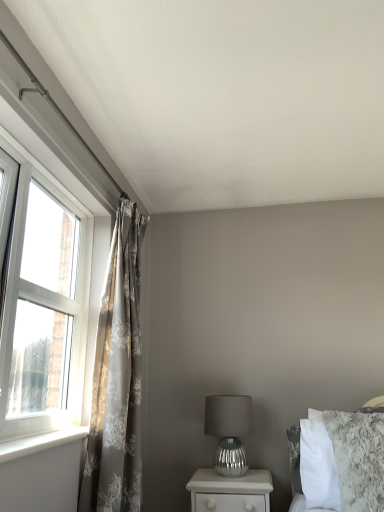
The width and height of the screenshot is (384, 512). In order to click on white plastic window at left in this screenshot , I will do `click(48, 305)`.

At what (x,y) coordinates should I click in order to perform the action: click on silky gray curtains at left. Please return your answer as a coordinate pair (x, y). The width and height of the screenshot is (384, 512). Looking at the image, I should click on point(117,377).

What do you see at coordinates (117, 377) in the screenshot?
I see `silky gray curtains at left` at bounding box center [117, 377].

Where is `white plastic window at left`? The height and width of the screenshot is (512, 384). white plastic window at left is located at coordinates (48, 305).

Is silky gray curtains at left to the left of silver metallic table lamp at center from the viewer's perspective?

Yes.

Consider the image. From a real-world perspective, which is physically above, silky gray curtains at left or silver metallic table lamp at center?

silky gray curtains at left.

Is silky gray curtains at left wider than silver metallic table lamp at center?

No, silky gray curtains at left is not wider than silver metallic table lamp at center.

Does silky gray curtains at left lie in front of silver metallic table lamp at center?

That is True.

Is white plastic window at left oriented away from white plastic window sill at left?

No, white plastic window sill at left is not at the back of white plastic window at left.

Considering the relative sizes of white plastic window at left and white plastic window sill at left in the image provided, is white plastic window at left thinner than white plastic window sill at left?

No.

Considering the relative sizes of white plastic window at left and white plastic window sill at left in the image provided, is white plastic window at left shorter than white plastic window sill at left?

Incorrect, the height of white plastic window at left does not fall short of that of white plastic window sill at left.

Where is `curtain below the white plastic window at left (from the image's perspective)`? This screenshot has width=384, height=512. curtain below the white plastic window at left (from the image's perspective) is located at coordinates (117, 377).

Is white plastic window at left wider or thinner than silky gray curtains at left?

Considering their sizes, white plastic window at left looks slimmer than silky gray curtains at left.

Which point is more distant from viewer, (69, 313) or (122, 466)?

The point (69, 313) is behind.

In the scene shown: Is white plastic window at left looking in the opposite direction of silky gray curtains at left?

No, white plastic window at left is not facing away from silky gray curtains at left.

From the image's perspective, which is below, silky gray curtains at left or white fluffy bed at upper right?

white fluffy bed at upper right is shown below in the image.

From their relative heights in the image, would you say silky gray curtains at left is taller or shorter than white fluffy bed at upper right?

Considering their sizes, silky gray curtains at left has more height than white fluffy bed at upper right.

Are silky gray curtains at left and white fluffy bed at upper right making contact?

silky gray curtains at left and white fluffy bed at upper right are clearly separated.

Is white fluffy bed at upper right a part of silky gray curtains at left?

No, white fluffy bed at upper right is not inside silky gray curtains at left.

How much distance is there between white plastic window sill at left and white fluffy bed at upper right?

A distance of 1.11 meters exists between white plastic window sill at left and white fluffy bed at upper right.

Is white plastic window sill at left turned away from white fluffy bed at upper right?

No, white plastic window sill at left's orientation is not away from white fluffy bed at upper right.

Would you say white fluffy bed at upper right is part of white plastic window sill at left's contents?

No, white fluffy bed at upper right is not a part of white plastic window sill at left.

Does white plastic window sill at left contain white plastic window at left?

No, white plastic window sill at left does not contain white plastic window at left.

Considering the sizes of white plastic window sill at left and white plastic window at left in the image, is white plastic window sill at left taller or shorter than white plastic window at left?

Considering their sizes, white plastic window sill at left has less height than white plastic window at left.

Is white plastic window sill at left oriented towards white plastic window at left?

No, white plastic window sill at left is not oriented towards white plastic window at left.

Is white plastic window sill at left bigger or smaller than white plastic window at left?

In the image, white plastic window sill at left appears to be smaller than white plastic window at left.

From the image's perspective, relative to silver metallic table lamp at center, is white plastic window at left above or below?

From the image's perspective, white plastic window at left appears above silver metallic table lamp at center.

Which object is positioned more to the left, white plastic window at left or silver metallic table lamp at center?

Positioned to the left is white plastic window at left.

Where is `table lamp below the silky gray curtains at left (from a real-world perspective)`? table lamp below the silky gray curtains at left (from a real-world perspective) is located at coordinates (229, 431).

At what (x,y) coordinates should I click in order to perform the action: click on window located on the left of white plastic window sill at left. Please return your answer as a coordinate pair (x, y). Looking at the image, I should click on (48, 305).

From the image, which object appears to be nearer to silver metallic nightstand at lower center, white fluffy bed at upper right or silky gray curtains at left?

Among the two, white fluffy bed at upper right is located nearer to silver metallic nightstand at lower center.

Considering their positions, is silver metallic nightstand at lower center positioned further to silky gray curtains at left than silver metallic table lamp at center?

silver metallic nightstand at lower center is positioned further to the anchor silky gray curtains at left.

Considering their positions, is white plastic window at left positioned further to silky gray curtains at left than silver metallic table lamp at center?

silver metallic table lamp at center.

From the picture: Considering their positions, is silver metallic table lamp at center positioned further to silky gray curtains at left than white fluffy bed at upper right?

white fluffy bed at upper right.

Estimate the real-world distances between objects in this image. Which object is further from white fluffy bed at upper right, silver metallic nightstand at lower center or silky gray curtains at left?

silky gray curtains at left is further to white fluffy bed at upper right.

Which object lies further to the anchor point silky gray curtains at left, silver metallic nightstand at lower center or white fluffy bed at upper right?

white fluffy bed at upper right is further to silky gray curtains at left.

Based on their spatial positions, is silver metallic nightstand at lower center or white plastic window at left closer to white plastic window sill at left?

Among the two, white plastic window at left is located nearer to white plastic window sill at left.

Based on their spatial positions, is silky gray curtains at left or silver metallic table lamp at center closer to silver metallic nightstand at lower center?

The object closer to silver metallic nightstand at lower center is silver metallic table lamp at center.

Where is `nightstand between white plastic window at left and white fluffy bed at upper right from left to right`? The height and width of the screenshot is (512, 384). nightstand between white plastic window at left and white fluffy bed at upper right from left to right is located at coordinates (230, 490).

The height and width of the screenshot is (512, 384). In order to click on nightstand between white plastic window at left and silver metallic table lamp at center from front to back in this screenshot , I will do `click(230, 490)`.

Locate an element on the screen. window sill positioned between white plastic window at left and silver metallic table lamp at center from near to far is located at coordinates (40, 442).

Where is `nightstand situated between silky gray curtains at left and white fluffy bed at upper right from left to right`? nightstand situated between silky gray curtains at left and white fluffy bed at upper right from left to right is located at coordinates (230, 490).